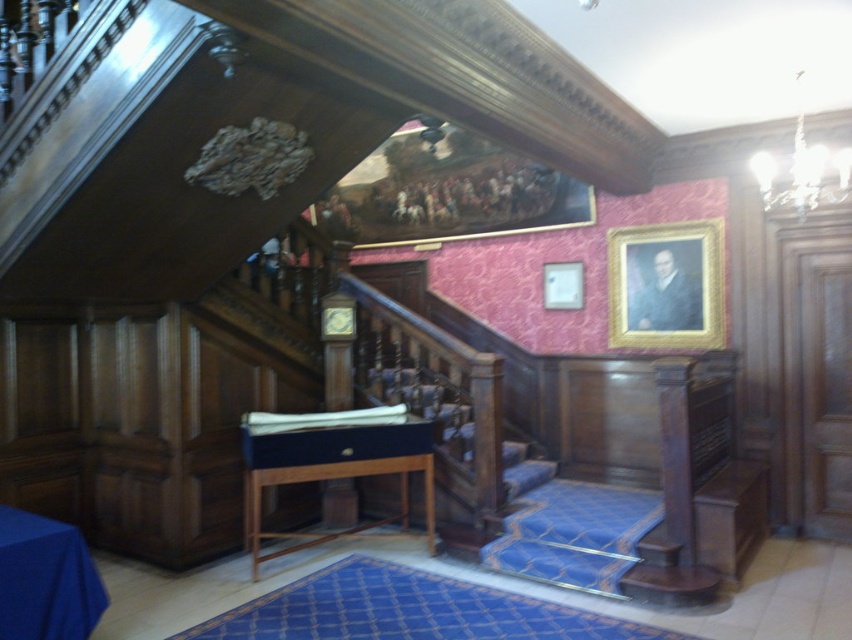
You are an interior designer assessing the space. You need to determine which object occupies more horizontal space in the room. Which is wider, the oil painting at upper center or the blue fabric tablecloth at lower left?

The oil painting at upper center is wider than the blue fabric tablecloth at lower left according to the description.